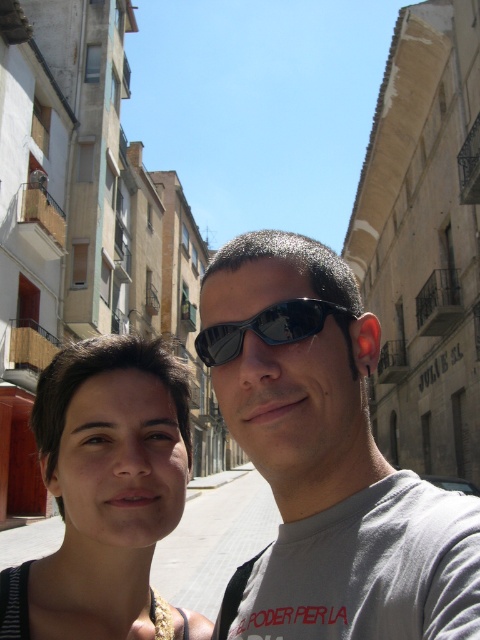
Looking at this image, does matte gray t-shirt at center have a greater height compared to black reflective sunglasses at center?

Yes, matte gray t-shirt at center is taller than black reflective sunglasses at center.

Between matte gray t-shirt at center and black reflective sunglasses at center, which one is positioned lower?

matte gray t-shirt at center

At what (x,y) coordinates should I click in order to perform the action: click on matte gray t-shirt at center. Please return your answer as a coordinate pair (x, y). Looking at the image, I should click on coord(327,458).

The image size is (480, 640). Identify the location of matte gray t-shirt at center. (327, 458).

Can you confirm if matte gray t-shirt at center is positioned to the right of matte black hair at center?

Indeed, matte gray t-shirt at center is positioned on the right side of matte black hair at center.

Which is more to the left, matte gray t-shirt at center or matte black hair at center?

matte black hair at center

Measure the distance between matte gray t-shirt at center and camera.

They are 11.72 meters apart.

Find the location of `matte gray t-shirt at center`. matte gray t-shirt at center is located at coordinates (327, 458).

Measure the distance between matte black hair at center and black reflective sunglasses at center.

4.83 meters

Between matte black hair at center and black reflective sunglasses at center, which one is positioned lower?

matte black hair at center is lower down.

You are a GUI agent. You are given a task and a screenshot of the screen. Output one action in this format:
    pyautogui.click(x=<x>, y=<y>)
    Task: Click on the matte black hair at center
    The image size is (480, 640).
    Given the screenshot: What is the action you would take?
    coord(106,493)